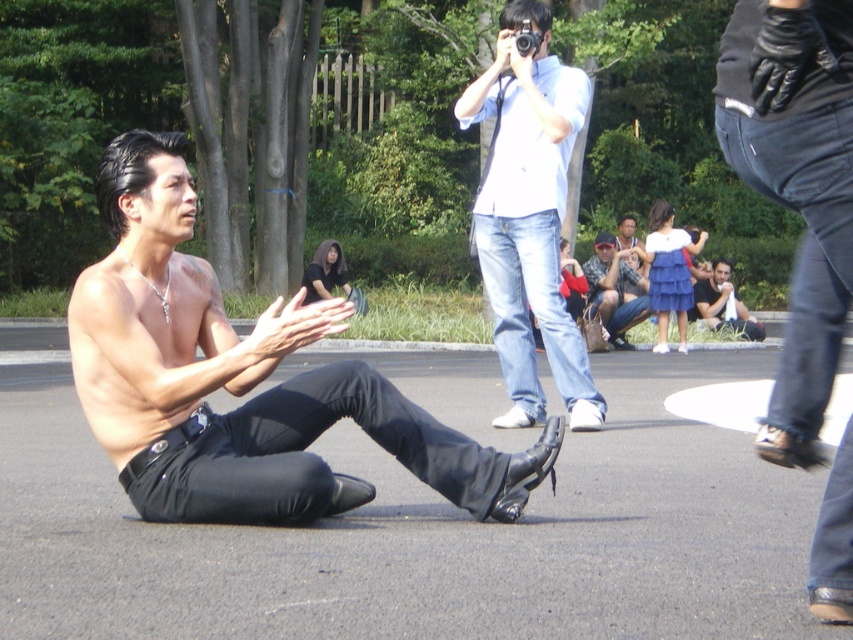
You are a GUI agent. You are given a task and a screenshot of the screen. Output one action in this format:
    pyautogui.click(x=<x>, y=<y>)
    Task: Click on the shiny black pants at center
    This screenshot has height=640, width=853.
    Given the screenshot: What is the action you would take?
    pyautogui.click(x=241, y=380)

Can you confirm if shiny black pants at center is smaller than matte blue jeans at center?

No.

What do you see at coordinates (241, 380) in the screenshot?
I see `shiny black pants at center` at bounding box center [241, 380].

This screenshot has width=853, height=640. I want to click on shiny black pants at center, so click(241, 380).

Between point (532, 193) and point (628, 230), which one is positioned in front?

Point (532, 193) is more forward.

Is white cotton shirt at upper center to the left of matte black shirt at center from the viewer's perspective?

Correct, you'll find white cotton shirt at upper center to the left of matte black shirt at center.

Does point (531, 196) come farther from viewer compared to point (634, 269)?

No.

Identify the location of white cotton shirt at upper center. (531, 218).

Can you confirm if matte blue jeans at center is taller than black cotton shirt at lower right?

Yes, matte blue jeans at center is taller than black cotton shirt at lower right.

Can you confirm if matte blue jeans at center is positioned above black cotton shirt at lower right?

Yes.

Does point (613, 301) come closer to viewer compared to point (726, 264)?

Yes, point (613, 301) is closer to viewer.

At what (x,y) coordinates should I click in order to perform the action: click on matte blue jeans at center. Please return your answer as a coordinate pair (x, y). The image size is (853, 640). Looking at the image, I should click on (614, 289).